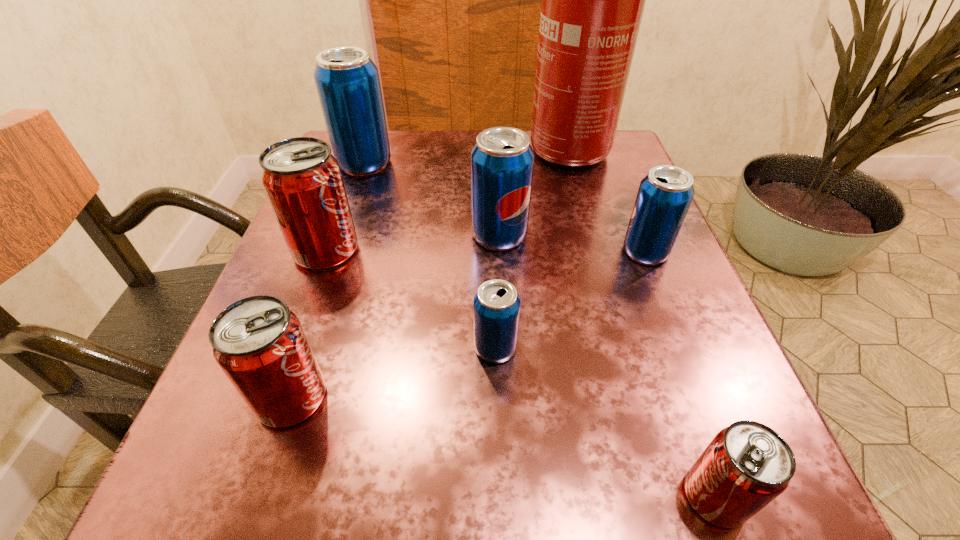
Identify which red pop soda is the nearest to the leftmost blue pop soda. Please provide its 2D coordinates. Your answer should be formatted as a tuple, i.e. [(x, y)], where the tuple contains the x and y coordinates of a point satisfying the conditions above.

[(302, 179)]

Locate which red pop soda is the second closest to the third smallest blue pop soda. Please provide its 2D coordinates. Your answer should be formatted as a tuple, i.e. [(x, y)], where the tuple contains the x and y coordinates of a point satisfying the conditions above.

[(260, 345)]

Image resolution: width=960 pixels, height=540 pixels. I want to click on free region that satisfies the following two spatial constraints: 1. on the trigger side of the third biggest blue pop soda; 2. on the right side of the red fire extinguisher, so click(583, 252).